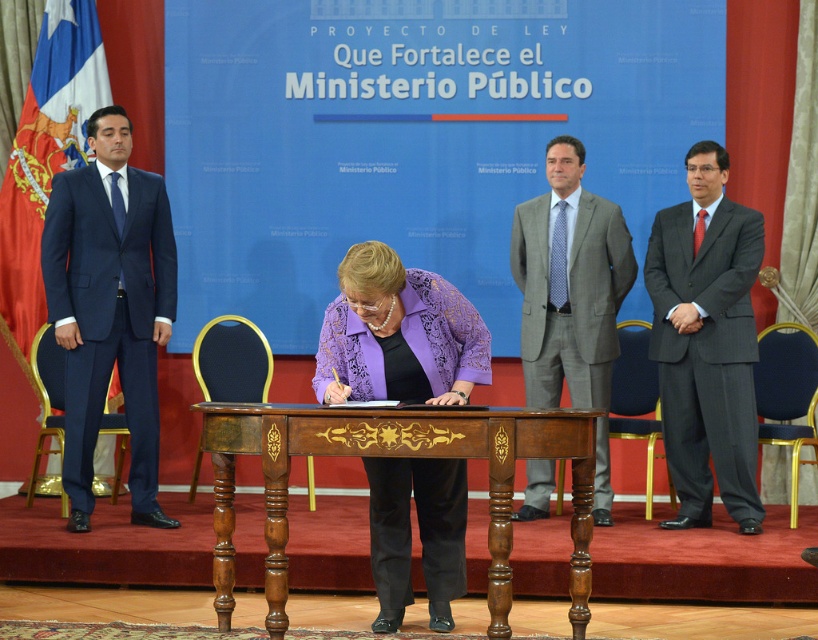
Is purple textured blouse at center smaller than dark gray suit at right?

Correct, purple textured blouse at center occupies less space than dark gray suit at right.

Does purple textured blouse at center appear over dark gray suit at right?

No.

Is point (457, 342) positioned in front of point (691, 371)?

Yes.

What are the coordinates of `purple textured blouse at center` in the screenshot? It's located at (398, 333).

Is dark gray suit at right taller than gray textured suit at center?

In fact, dark gray suit at right may be shorter than gray textured suit at center.

Find the location of a particular element. The height and width of the screenshot is (640, 818). dark gray suit at right is located at coordinates (706, 342).

You are a GUI agent. You are given a task and a screenshot of the screen. Output one action in this format:
    pyautogui.click(x=<x>, y=<y>)
    Task: Click on the dark gray suit at right
    
    Given the screenshot: What is the action you would take?
    pyautogui.click(x=706, y=342)

Who is more distant from viewer, (154, 308) or (371, 285)?

The point (154, 308) is behind.

Does navy blue suit at left appear under purple textured blouse at center?

Actually, navy blue suit at left is above purple textured blouse at center.

Locate an element on the screen. The image size is (818, 640). navy blue suit at left is located at coordinates (109, 307).

Identify the location of navy blue suit at left. Image resolution: width=818 pixels, height=640 pixels. (109, 307).